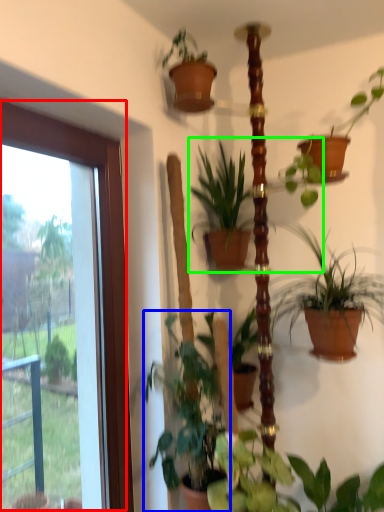
Question: Which object is the closest to the window (highlighted by a red box)? Choose among these: houseplant (highlighted by a blue box) or houseplant (highlighted by a green box).

Choices:
 (A) houseplant
 (B) houseplant

Answer: (A)